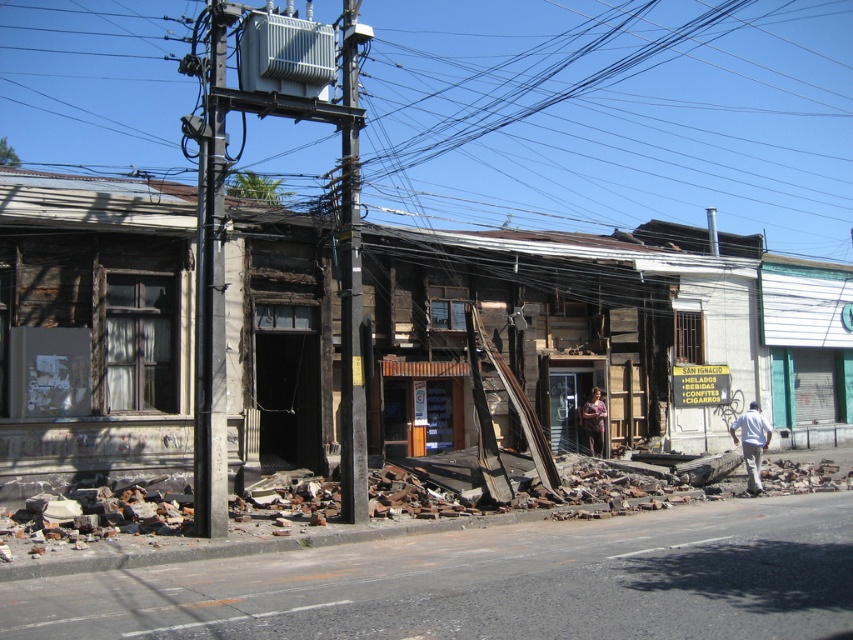
Question: Which of the following is the closest to the observer?

Choices:
 (A) click(758, 428)
 (B) click(352, 252)

Answer: (B)

Question: Which object is closer to the camera taking this photo?

Choices:
 (A) white matte shirt at lower right
 (B) metallic gray utility pole at left

Answer: (B)

Question: Estimate the real-world distances between objects in this image. Which object is closer to the metallic gray utility pole at left?

Choices:
 (A) black metal/wooden pole at center
 (B) white matte shirt at lower right

Answer: (A)

Question: Is metallic gray utility pole at left in front of black metal/wooden pole at center?

Choices:
 (A) no
 (B) yes

Answer: (B)

Question: Is metallic gray utility pole at left smaller than black metal/wooden pole at center?

Choices:
 (A) no
 (B) yes

Answer: (B)

Question: Does black metal/wooden pole at center have a larger size compared to white matte shirt at lower right?

Choices:
 (A) yes
 (B) no

Answer: (A)